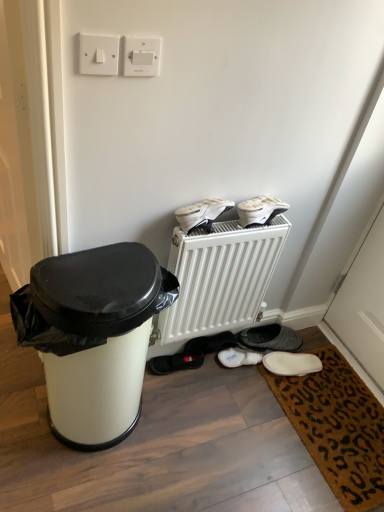
This screenshot has width=384, height=512. What are the coordinates of `free space above white matte plastic trash can at left (from a real-world perspective)` in the screenshot? It's located at (102, 276).